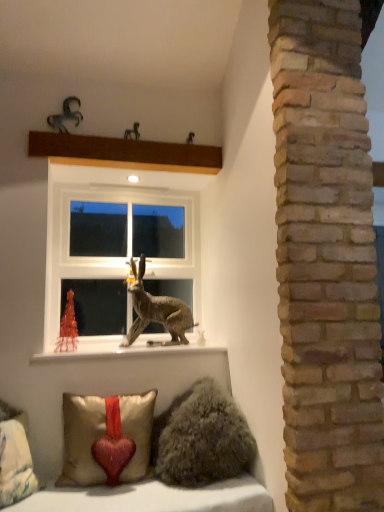
Describe the element at coordinates (156, 311) in the screenshot. Image resolution: width=384 pixels, height=512 pixels. I see `metallic brown rabbit at center, placed as the 3th animal when sorted from left to right` at that location.

Consider the image. Measure the distance between point [129,343] and camera.

Point [129,343] is 7.35 feet away from camera.

This screenshot has height=512, width=384. In order to click on metallic horse at upper left, the fourth animal when ordered from bottom to top in this screenshot , I will do `click(66, 115)`.

Measure the distance between point (x=77, y=117) and camera.

They are 7.09 feet apart.

Locate an element on the screen. fuzzy brown pillow at lower center, the fourth animal when ordered from back to front is located at coordinates (x=201, y=438).

How much space does metallic horse at upper center, which appears as the second animal when viewed from the left, occupy vertically?

The height of metallic horse at upper center, which appears as the second animal when viewed from the left, is 3.86 inches.

What is the approximate width of white plastic window at center?

white plastic window at center is 6.09 centimeters wide.

This screenshot has height=512, width=384. In order to click on brown wooden beam at upper center in this screenshot , I will do `click(124, 153)`.

At what (x,y) coordinates should I click in order to perform the action: click on metallic brown rabbit at center, marked as the 2th animal in a back-to-front arrangement. Please return your answer as a coordinate pair (x, y). Image resolution: width=384 pixels, height=512 pixels. Looking at the image, I should click on (156, 311).

Is white glossy window sill at lower center next to white plastic window at center?

There is a gap between white glossy window sill at lower center and white plastic window at center.

Could you tell me if white glossy window sill at lower center is facing white plastic window at center?

No, white glossy window sill at lower center is not facing towards white plastic window at center.

Do you think white glossy window sill at lower center is within white plastic window at center, or outside of it?

white glossy window sill at lower center exists outside the volume of white plastic window at center.

Between white glossy window sill at lower center and white plastic window at center, which one has larger size?

Bigger between the two is white plastic window at center.

Where is `the 1st animal to the right of the brown wooden beam at upper center, starting your count from the anchor`? the 1st animal to the right of the brown wooden beam at upper center, starting your count from the anchor is located at coordinates (133, 132).

From a real-world perspective, is metallic horse at upper center, which appears as the second animal when viewed from the left, above or below brown wooden beam at upper center?

Clearly, from a real-world perspective, metallic horse at upper center, which appears as the second animal when viewed from the left, is above brown wooden beam at upper center.

Considering the relative sizes of metallic horse at upper center, which is counted as the fourth animal, starting from the front, and brown wooden beam at upper center in the image provided, is metallic horse at upper center, which is counted as the fourth animal, starting from the front, taller than brown wooden beam at upper center?

No.

Which object is positioned more to the right, metallic horse at upper center, which is counted as the second animal, starting from the top, or brown wooden beam at upper center?

metallic horse at upper center, which is counted as the second animal, starting from the top, is more to the right.

From the image's perspective, is white plastic window at center located above or below metallic horse at upper center, positioned as the third animal in right-to-left order?

white plastic window at center is below metallic horse at upper center, positioned as the third animal in right-to-left order.

Considering the sizes of objects white plastic window at center and metallic horse at upper center, placed as the 3th animal when sorted from bottom to top, in the image provided, who is thinner, white plastic window at center or metallic horse at upper center, placed as the 3th animal when sorted from bottom to top,?

metallic horse at upper center, placed as the 3th animal when sorted from bottom to top.

Can you confirm if white plastic window at center is smaller than metallic horse at upper center, which appears as the second animal when viewed from the left?

No, white plastic window at center is not smaller than metallic horse at upper center, which appears as the second animal when viewed from the left.

Is metallic horse at upper center, positioned as the third animal in right-to-left order, surrounded by white plastic window at center?

No, metallic horse at upper center, positioned as the third animal in right-to-left order, is not surrounded by white plastic window at center.

Is brown wooden beam at upper center behind velvet beige pillow with red heart at lower left, which appears as the 2th pillow when viewed from the right?

Yes, brown wooden beam at upper center is further from the camera.

Is brown wooden beam at upper center wider or thinner than velvet beige pillow with red heart at lower left, which appears as the 2th pillow when viewed from the right?

Considering their sizes, brown wooden beam at upper center looks slimmer than velvet beige pillow with red heart at lower left, which appears as the 2th pillow when viewed from the right.

From the image's perspective, is brown wooden beam at upper center over velvet beige pillow with red heart at lower left, arranged as the 1th pillow when viewed from the left?

Yes, from the image's perspective, brown wooden beam at upper center is over velvet beige pillow with red heart at lower left, arranged as the 1th pillow when viewed from the left.

Between brown wooden beam at upper center and metallic horse at upper center, positioned as the third animal in right-to-left order, which one has smaller width?

metallic horse at upper center, positioned as the third animal in right-to-left order.

From a real-world perspective, starting from the brown wooden beam at upper center, which animal is the 1st one vertically above it? Please provide its 2D coordinates.

[(133, 132)]

Which is closer, [126,160] or [136,131]?

Point [126,160] is closer to the camera than point [136,131].

Is brown wooden beam at upper center positioned far away from metallic horse at upper center, which is counted as the second animal, starting from the top?

No, brown wooden beam at upper center is not far away from metallic horse at upper center, which is counted as the second animal, starting from the top.

From the picture: Can you confirm if white plastic window at center is thinner than satin gold pillow with red heart at lower left, the second pillow from the left?

Yes, white plastic window at center is thinner than satin gold pillow with red heart at lower left, the second pillow from the left.

Is satin gold pillow with red heart at lower left, the first pillow positioned from the right, at the back of white plastic window at center?

No.

Does point (92, 253) appear closer or farther from the camera than point (73, 428)?

Point (92, 253) is positioned farther from the camera compared to point (73, 428).

Looking at this image, in terms of size, does white plastic window at center appear bigger or smaller than satin gold pillow with red heart at lower left, the first pillow positioned from the right?

In the image, white plastic window at center appears to be larger than satin gold pillow with red heart at lower left, the first pillow positioned from the right.

Which is farther, (172, 311) or (196, 386)?

The point (172, 311) is farther from the camera.

From a real-world perspective, is metallic brown rabbit at center, placed as the 2th animal when sorted from right to left, beneath fuzzy brown pillow at lower center, the fourth animal positioned from the left?

No, from a real-world perspective, metallic brown rabbit at center, placed as the 2th animal when sorted from right to left, is not beneath fuzzy brown pillow at lower center, the fourth animal positioned from the left.

This screenshot has height=512, width=384. In the image, there is a white glossy window sill at lower center. In order to click on window above it (from the image's perspective) in this screenshot , I will do `click(116, 247)`.

The height and width of the screenshot is (512, 384). I want to click on shelf in front of the metallic horse at upper center, placed as the 3th animal when sorted from bottom to top, so 124,153.

Considering their positions, is velvet beige pillow with red heart at lower left, arranged as the 1th pillow when viewed from the left, positioned further to metallic horse at upper center, the 1th animal in the back-to-front sequence, than white plastic window at center?

velvet beige pillow with red heart at lower left, arranged as the 1th pillow when viewed from the left, lies further to metallic horse at upper center, the 1th animal in the back-to-front sequence, than the other object.

Which object lies further to the anchor point fuzzy brown pillow at lower center, which appears as the 1th animal when viewed from the front, metallic brown rabbit at center, which is the 2th animal in bottom-to-top order, or metallic horse at upper left, which is counted as the first animal, starting from the left?

metallic horse at upper left, which is counted as the first animal, starting from the left.

Estimate the real-world distances between objects in this image. Which object is closer to fuzzy brown pillow at lower center, which is the first animal in bottom-to-top order, metallic brown rabbit at center, which is the 2th animal in bottom-to-top order, or brown wooden beam at upper center?

Among the two, metallic brown rabbit at center, which is the 2th animal in bottom-to-top order, is located nearer to fuzzy brown pillow at lower center, which is the first animal in bottom-to-top order.

Which object lies further to the anchor point white plastic window at center, satin gold pillow with red heart at lower left, the second pillow from the left, or brown wooden beam at upper center?

satin gold pillow with red heart at lower left, the second pillow from the left, is further to white plastic window at center.

When comparing their distances from white glossy window sill at lower center, does satin gold pillow with red heart at lower left, the second pillow from the left, or velvet beige pillow with red heart at lower left, which appears as the 2th pillow when viewed from the right, seem closer?

satin gold pillow with red heart at lower left, the second pillow from the left, lies closer to white glossy window sill at lower center than the other object.

Looking at the image, which one is located further to metallic horse at upper left, which is counted as the first animal, starting from the left, white glossy window sill at lower center or satin gold pillow with red heart at lower left, the first pillow positioned from the right?

satin gold pillow with red heart at lower left, the first pillow positioned from the right, lies further to metallic horse at upper left, which is counted as the first animal, starting from the left, than the other object.

Estimate the real-world distances between objects in this image. Which object is closer to metallic horse at upper center, which appears as the second animal when viewed from the left, fuzzy brown pillow at lower center, marked as the 4th animal in a top-to-bottom arrangement, or metallic brown rabbit at center, which is the 2th animal in bottom-to-top order?

Based on the image, metallic brown rabbit at center, which is the 2th animal in bottom-to-top order, appears to be nearer to metallic horse at upper center, which appears as the second animal when viewed from the left.

Based on the photo, considering their positions, is velvet beige pillow with red heart at lower left, which appears as the 2th pillow when viewed from the right, positioned closer to metallic horse at upper left, which is counted as the first animal, starting from the left, than white glossy window sill at lower center?

white glossy window sill at lower center is positioned closer to the anchor metallic horse at upper left, which is counted as the first animal, starting from the left.

Locate an element on the screen. window sill between velvet beige pillow with red heart at lower left, which appears as the 2th pillow when viewed from the right, and white plastic window at center, along the z-axis is located at coordinates (127, 352).

What are the coordinates of `window between metallic horse at upper left, the fourth animal when ordered from bottom to top, and velvet beige pillow with red heart at lower left, which appears as the 2th pillow when viewed from the right, in the vertical direction` in the screenshot? It's located at (116, 247).

The image size is (384, 512). I want to click on window that lies between brown wooden beam at upper center and metallic brown rabbit at center, which appears as the 3th animal when viewed from the top, from top to bottom, so click(116, 247).

Image resolution: width=384 pixels, height=512 pixels. In order to click on animal between white plastic window at center and white glossy window sill at lower center from top to bottom in this screenshot , I will do `click(156, 311)`.